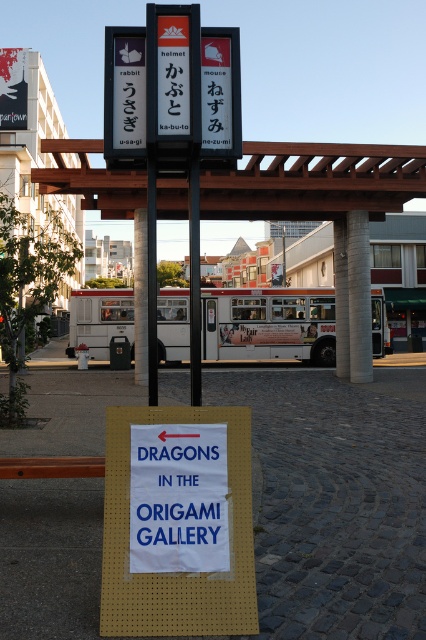
You are a tourist holding a map and standing in front of the white paper sign at center and the white matte bus at center. Which object is nearer to you?

The white paper sign at center is closer to the viewer than the white matte bus at center.

You are a tourist holding a map and standing in front of the wooden signpost at center and the white matte bus at center. You want to take a photo of both objects in the same frame. Which object should you position closer to the camera to ensure both are in focus?

Since the wooden signpost at center is closer to the viewer than the white matte bus at center, you should position the camera closer to the wooden signpost at center to ensure both are in focus as they are at different distances from the camera.